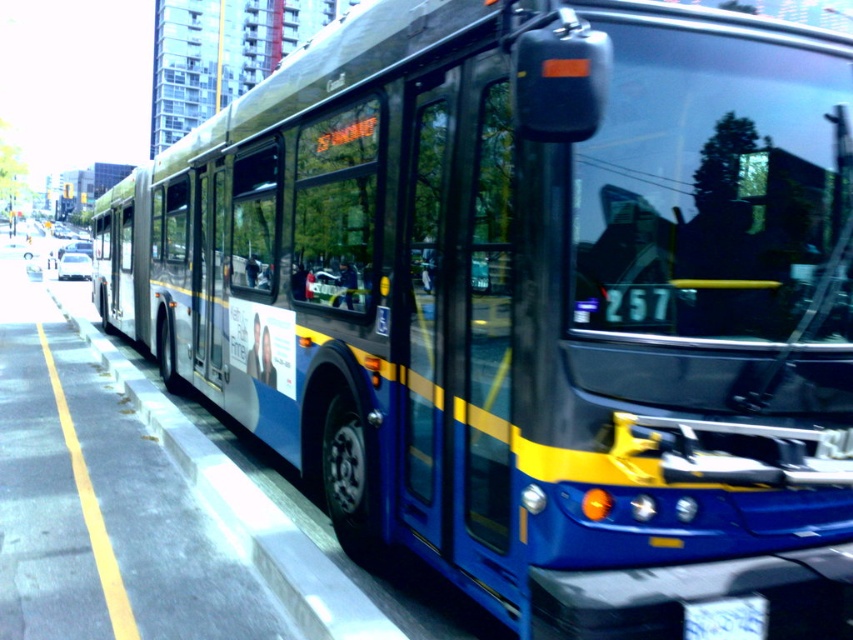
Question: Is concrete curb at lower left thinner than white plastic license plate at center?

Choices:
 (A) no
 (B) yes

Answer: (A)

Question: Can you confirm if concrete curb at lower left is thinner than white plastic license plate at center?

Choices:
 (A) yes
 (B) no

Answer: (B)

Question: Which point appears closest to the camera in this image?

Choices:
 (A) (368, 624)
 (B) (746, 627)

Answer: (B)

Question: Does concrete curb at lower left appear on the left side of white plastic license plate at center?

Choices:
 (A) no
 (B) yes

Answer: (B)

Question: Among these objects, which one is nearest to the camera?

Choices:
 (A) concrete curb at lower left
 (B) white plastic license plate at center

Answer: (B)